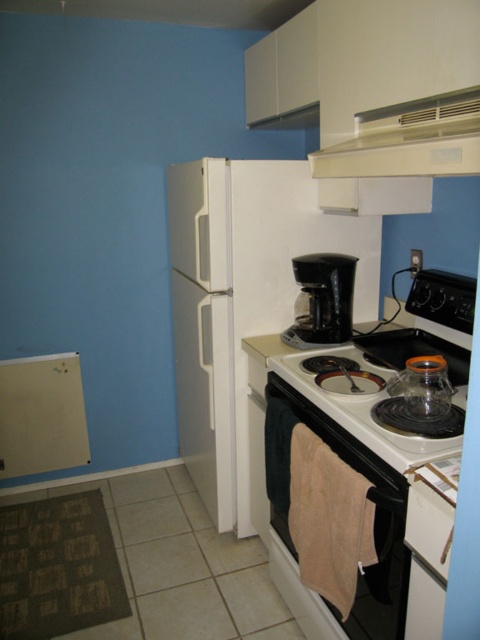
Question: Is white matte refrigerator at left to the left of white glossy gas stove at center from the viewer's perspective?

Choices:
 (A) yes
 (B) no

Answer: (A)

Question: Among these objects, which one is farthest from the camera?

Choices:
 (A) black plastic coffee maker at center
 (B) white glossy gas stove at center

Answer: (A)

Question: Which point is closer to the camera?

Choices:
 (A) white matte refrigerator at left
 (B) white plastic exhaust hood at upper center
 (C) black plastic coffee maker at center

Answer: (B)

Question: Which point is closer to the camera?

Choices:
 (A) white matte refrigerator at left
 (B) black plastic coffee maker at center
 (C) black glossy oven at center
 (D) white glossy gas stove at center

Answer: (D)

Question: Can you confirm if white plastic exhaust hood at upper center is positioned above black glossy oven at center?

Choices:
 (A) no
 (B) yes

Answer: (B)

Question: Is black glossy oven at center thinner than black plastic coffee maker at center?

Choices:
 (A) yes
 (B) no

Answer: (B)